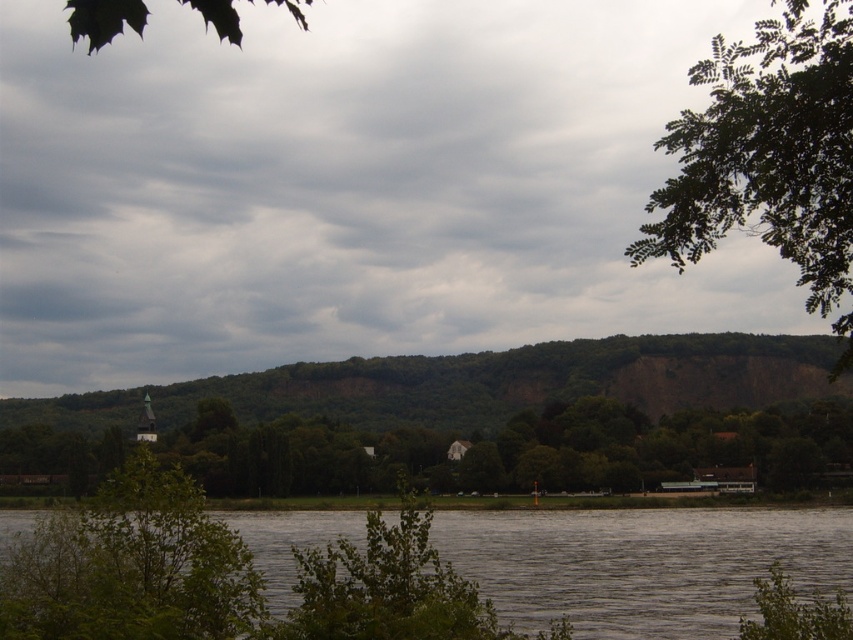
You are an artist trying to paint this landscape. You want to ensure that the gray water at lower center and the green matte leaf at upper left are proportionally accurate. Which object should you paint first to maintain the correct size relationship between them?

You should paint the green matte leaf at upper left first because it occupies more space in the image than the gray water at lower center, ensuring you allocate enough area for it before detailing the smaller gray water at lower center.

You are standing at the point labeled as point (572, 362) in the image. A friend is located 200 meters directly behind you. Can your friend see the church steeple through the dense trees and shrubs in the midground?

The point (572, 362) is 215.15 meters away from the viewer. Since your friend is 200 meters behind you, they would be 415.15 meters away from the point. However, the question of whether they can see the church steeple depends on the line of sight and the density of the trees between them and the steeple. The provided information does not specify the arrangement or height of the trees, so we cannot confirm visibility.